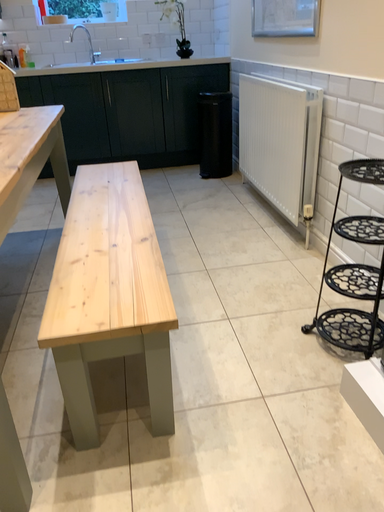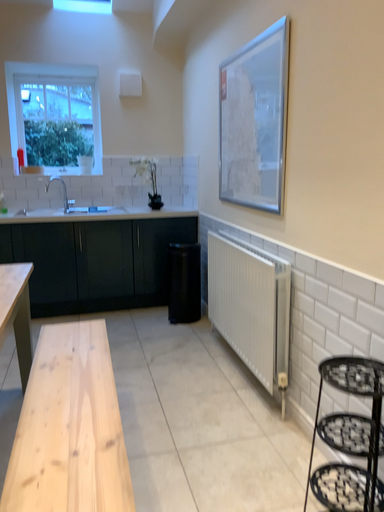
Question: Which way did the camera rotate in the video?

Choices:
 (A) rotated upward
 (B) rotated downward

Answer: (A)